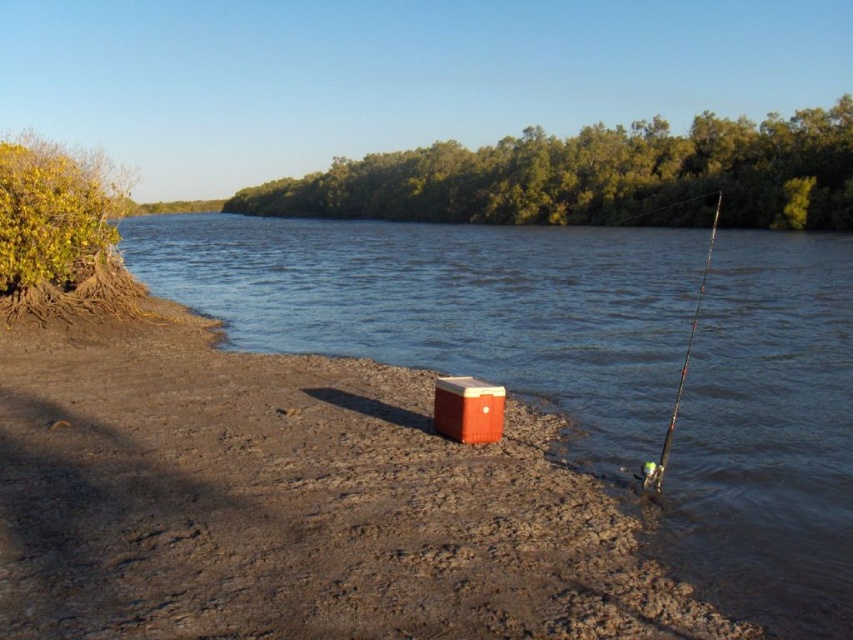
Question: Which point appears farthest from the camera in this image?

Choices:
 (A) (485, 300)
 (B) (682, 376)
 (C) (454, 381)

Answer: (A)

Question: Which point is closer to the camera?

Choices:
 (A) smooth water at center
 (B) shiny metallic fishing pole at right

Answer: (A)

Question: Is orange matte cooler at center further to the viewer compared to shiny metallic fishing pole at right?

Choices:
 (A) no
 (B) yes

Answer: (B)

Question: Which of the following is the closest to the observer?

Choices:
 (A) (677, 403)
 (B) (704, 358)

Answer: (A)

Question: Can you confirm if smooth water at center is positioned above orange matte cooler at center?

Choices:
 (A) yes
 (B) no

Answer: (A)

Question: Is smooth water at center below orange matte cooler at center?

Choices:
 (A) no
 (B) yes

Answer: (A)